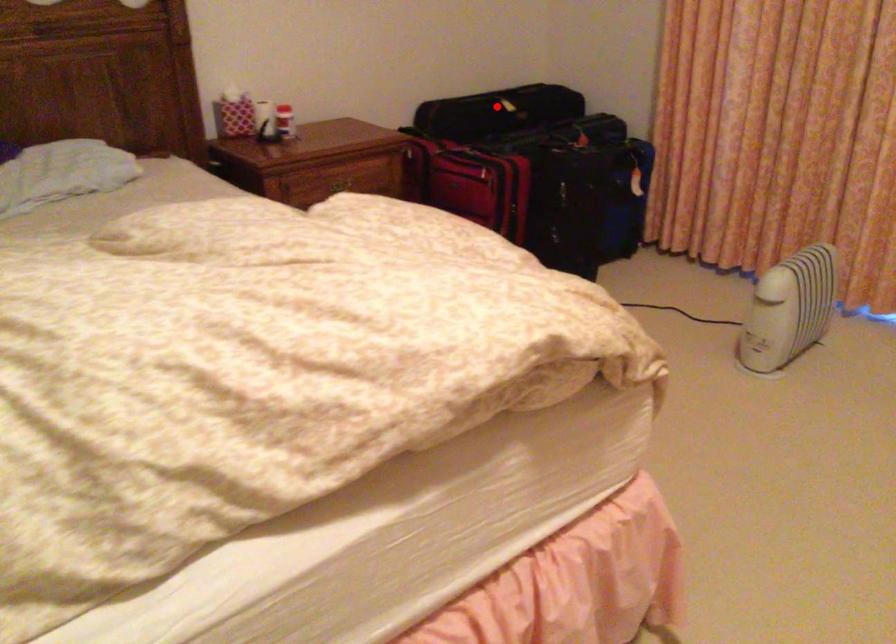
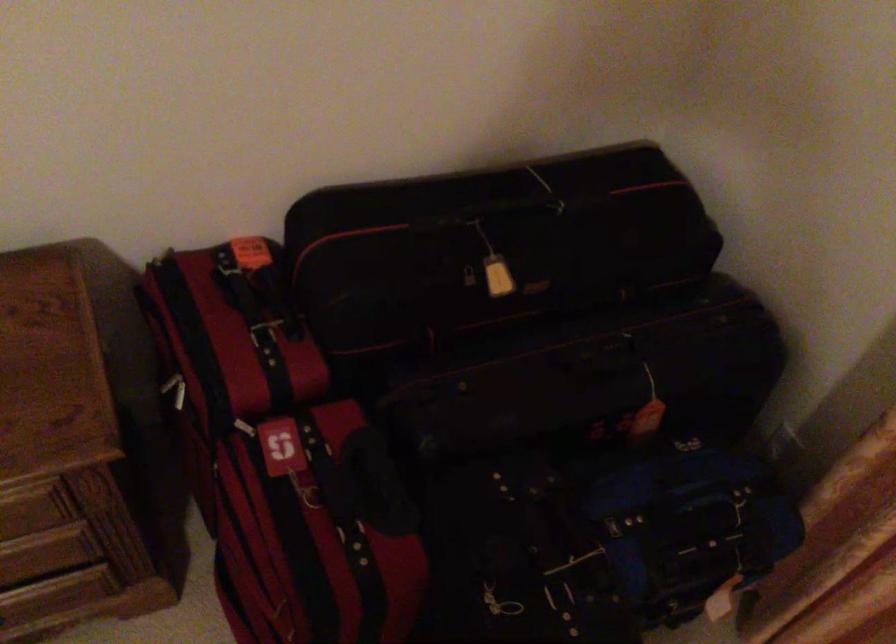
In the second image, find the point that corresponds to the highlighted location in the first image.

(470, 287)